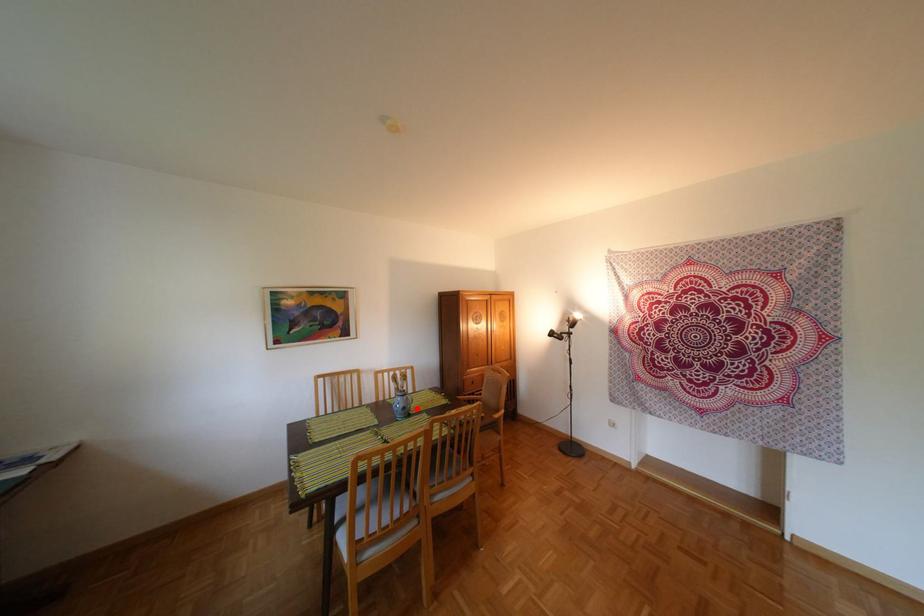
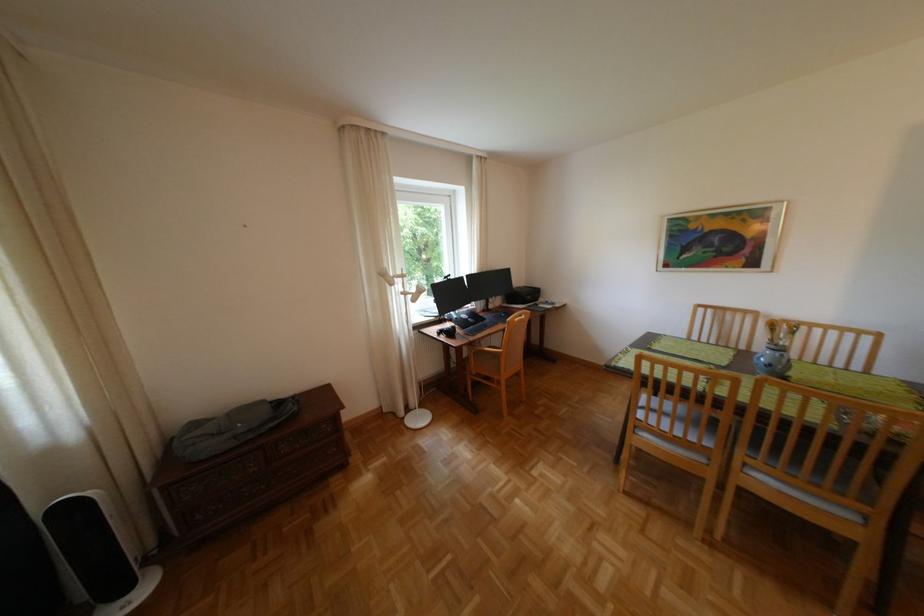
In the second image, find the point that corresponds to the highlighted location in the first image.

(782, 365)